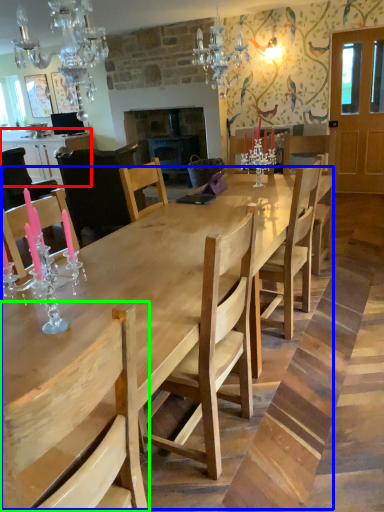
Question: Considering the real-world distances, which object is closest to cabinetry (highlighted by a red box)? kitchen & dining room table (highlighted by a blue box) or chair (highlighted by a green box).

Choices:
 (A) kitchen & dining room table
 (B) chair

Answer: (A)